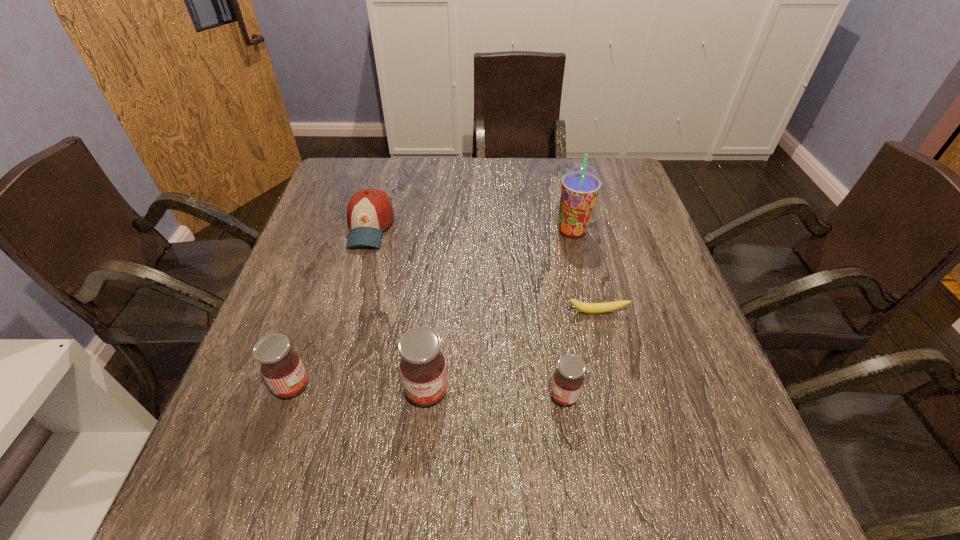
Find the location of a particular element. The height and width of the screenshot is (540, 960). free location located on the label side of the second shortest jam is located at coordinates (362, 386).

Where is `vacant space located 0.380m on the label side of the fourth object from left to right`? vacant space located 0.380m on the label side of the fourth object from left to right is located at coordinates (348, 396).

The width and height of the screenshot is (960, 540). What are the coordinates of `free location located on the label side of the fourth object from left to right` in the screenshot? It's located at (348, 396).

The image size is (960, 540). Identify the location of free space located on the label side of the fourth object from left to right. (412, 396).

Image resolution: width=960 pixels, height=540 pixels. I want to click on free region located 0.260m on the left of the smoothie, so click(457, 231).

The height and width of the screenshot is (540, 960). Identify the location of vacant area situated 0.100m on the front-facing side of the baseball cap. (355, 280).

Locate an element on the screen. free space located 0.090m on the upward curve of the fourth nearest object is located at coordinates (606, 349).

I want to click on jam present at the left edge, so click(280, 365).

Where is `baseball cap present at the left edge`? baseball cap present at the left edge is located at coordinates (369, 212).

I want to click on object that is at the right edge, so click(591, 308).